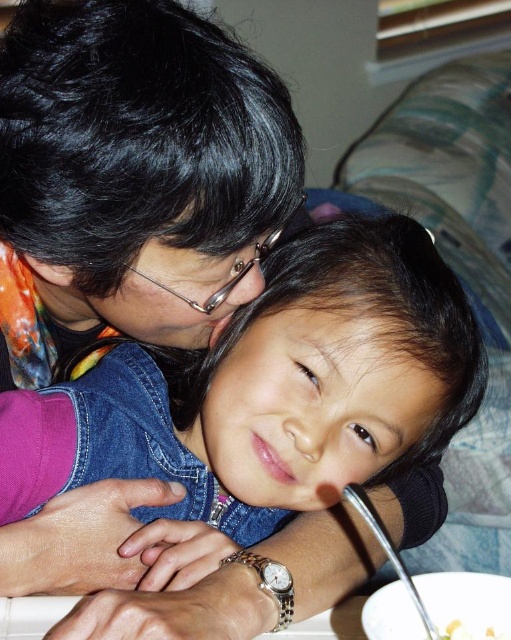
Consider the image. Can you confirm if denim at center is bigger than metallic frame glasses at upper center?

Yes, denim at center is bigger than metallic frame glasses at upper center.

Is denim at center above metallic frame glasses at upper center?

No.

The width and height of the screenshot is (511, 640). What do you see at coordinates (267, 397) in the screenshot? I see `denim at center` at bounding box center [267, 397].

This screenshot has height=640, width=511. Find the location of `denim at center`. denim at center is located at coordinates (267, 397).

How distant is denim at center from yellow matte food at lower right?

denim at center is 10.53 inches from yellow matte food at lower right.

Does denim at center appear over yellow matte food at lower right?

Indeed, denim at center is positioned over yellow matte food at lower right.

I want to click on denim at center, so click(x=267, y=397).

Where is `denim at center`? Image resolution: width=511 pixels, height=640 pixels. denim at center is located at coordinates (267, 397).

Can you confirm if metallic frame glasses at upper center is positioned to the right of yellow matte food at lower right?

Incorrect, metallic frame glasses at upper center is not on the right side of yellow matte food at lower right.

Which is in front, point (183, 294) or point (498, 636)?

Point (498, 636) is more forward.

Find the location of a particular element. This screenshot has height=640, width=511. metallic frame glasses at upper center is located at coordinates (236, 262).